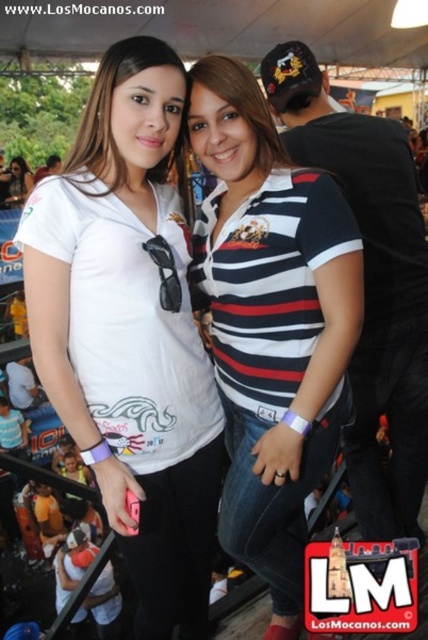
Question: Which point appears farthest from the camera in this image?

Choices:
 (A) (8, 164)
 (B) (299, 481)
 (C) (113, 49)

Answer: (A)

Question: Can you confirm if white matte t-shirt at upper left is positioned below striped cotton shirt at center?

Choices:
 (A) yes
 (B) no

Answer: (A)

Question: Is white matte t-shirt at upper left wider than striped cotton shirt at center?

Choices:
 (A) no
 (B) yes

Answer: (B)

Question: Is the position of striped cotton shirt at center less distant than that of matte white shirt at upper left?

Choices:
 (A) no
 (B) yes

Answer: (B)

Question: Among these points, which one is farthest from the camera?

Choices:
 (A) pyautogui.click(x=17, y=200)
 (B) pyautogui.click(x=276, y=588)

Answer: (A)

Question: Which object is positioned farthest from the striped cotton shirt at center?

Choices:
 (A) matte white shirt at upper left
 (B) white matte t-shirt at upper left

Answer: (A)